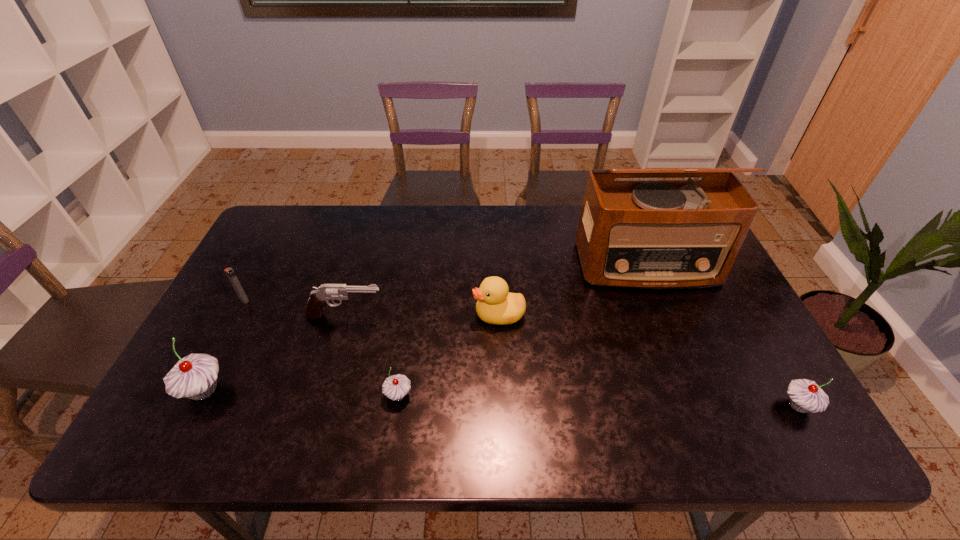
Locate an element on the screen. The height and width of the screenshot is (540, 960). cupcake at the left edge is located at coordinates (195, 376).

Identify the location of igniter that is at the left edge. (230, 273).

Where is `cupcake that is positioned at the right edge`? The image size is (960, 540). cupcake that is positioned at the right edge is located at coordinates pyautogui.click(x=805, y=395).

Find the location of a particular element. radio receiver at the right edge is located at coordinates (655, 234).

In order to click on object positioned at the near left corner in this screenshot , I will do `click(195, 376)`.

Locate an element on the screen. object situated at the far right corner is located at coordinates (655, 234).

This screenshot has height=540, width=960. I want to click on object at the near right corner, so click(x=805, y=395).

Where is `blank area at the far edge`? The width and height of the screenshot is (960, 540). blank area at the far edge is located at coordinates pos(405,214).

What are the coordinates of `free space at the near edge of the desktop` in the screenshot? It's located at (500, 378).

You are a GUI agent. You are given a task and a screenshot of the screen. Output one action in this format:
    pyautogui.click(x=<x>, y=<y>)
    Task: Click on the free space at the left edge
    The width and height of the screenshot is (960, 540).
    Given the screenshot: What is the action you would take?
    pyautogui.click(x=245, y=334)